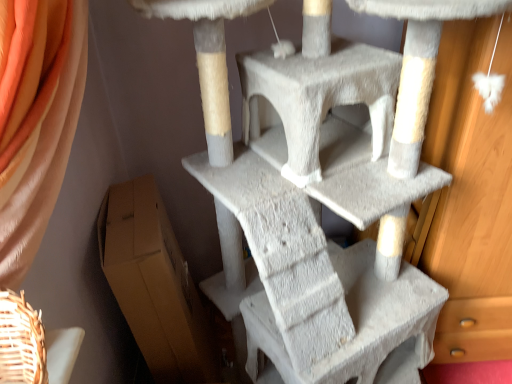
Question: Does brown cardboard box at lower left have a greater width compared to white textured cat tree at center?

Choices:
 (A) yes
 (B) no

Answer: (B)

Question: Can you confirm if brown cardboard box at lower left is positioned to the left of white textured cat tree at center?

Choices:
 (A) no
 (B) yes

Answer: (B)

Question: From a real-world perspective, is brown cardboard box at lower left over white textured cat tree at center?

Choices:
 (A) yes
 (B) no

Answer: (B)

Question: Does brown cardboard box at lower left have a greater height compared to white textured cat tree at center?

Choices:
 (A) no
 (B) yes

Answer: (A)

Question: Can you confirm if brown cardboard box at lower left is bigger than white textured cat tree at center?

Choices:
 (A) yes
 (B) no

Answer: (B)

Question: Does brown cardboard box at lower left have a smaller size compared to white textured cat tree at center?

Choices:
 (A) no
 (B) yes

Answer: (B)

Question: Is white textured cat tree at center not inside brown cardboard box at lower left?

Choices:
 (A) yes
 (B) no

Answer: (A)

Question: Is white textured cat tree at center facing towards brown cardboard box at lower left?

Choices:
 (A) no
 (B) yes

Answer: (A)

Question: Does white textured cat tree at center appear on the left side of brown cardboard box at lower left?

Choices:
 (A) no
 (B) yes

Answer: (A)

Question: Can you confirm if white textured cat tree at center is bigger than brown cardboard box at lower left?

Choices:
 (A) yes
 (B) no

Answer: (A)

Question: Is white textured cat tree at center closer to camera compared to brown cardboard box at lower left?

Choices:
 (A) yes
 (B) no

Answer: (A)

Question: Does white textured cat tree at center have a lesser width compared to brown cardboard box at lower left?

Choices:
 (A) no
 (B) yes

Answer: (A)

Question: Choose the correct answer: Is brown cardboard box at lower left inside white textured cat tree at center or outside it?

Choices:
 (A) inside
 (B) outside

Answer: (B)